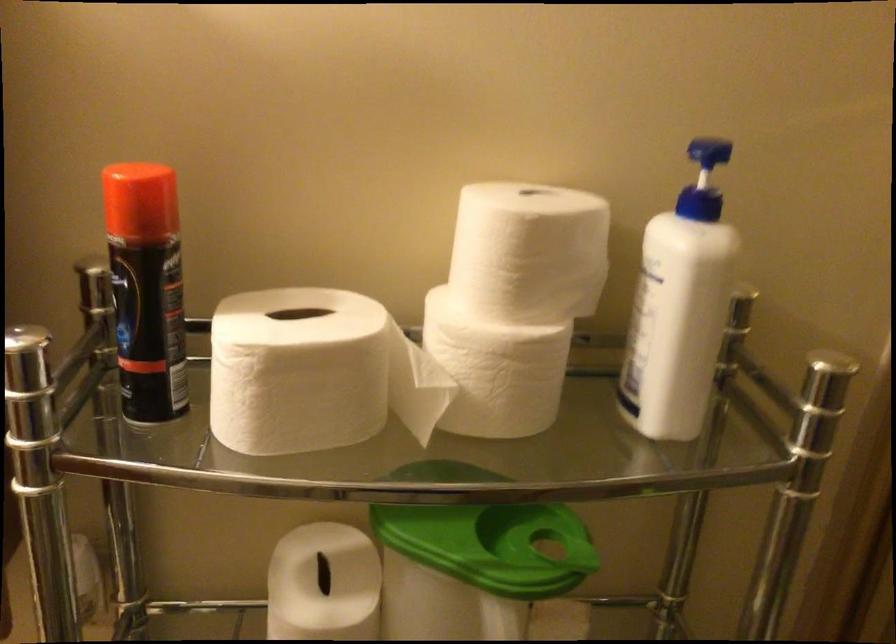
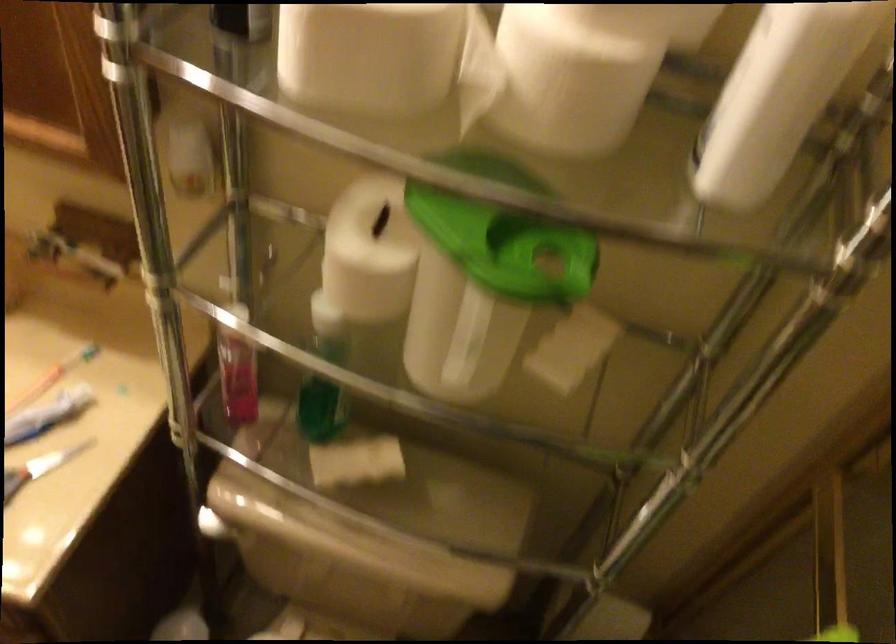
In the second image, find the point that corresponds to (x=520, y=359) in the first image.

(575, 73)